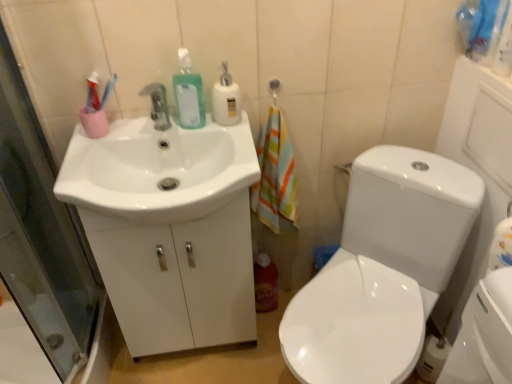
Question: Does point (328, 357) appear closer or farther from the camera than point (218, 117)?

Choices:
 (A) closer
 (B) farther

Answer: (A)

Question: Looking at their shapes, would you say white glossy toilet at right is wider or thinner than white glossy soap dispenser at upper center, the second cleaning product when ordered from left to right?

Choices:
 (A) thin
 (B) wide

Answer: (B)

Question: Which object is positioned closest to the white glossy toilet at right?

Choices:
 (A) green matte liquid soap at upper center, the third cleaning product in the bottom-to-top sequence
 (B) matte silver faucet at center
 (C) white glossy cabinet at left
 (D) white glossy soap dispenser at upper center, the second cleaning product when ordered from left to right
 (E) white glossy toilet at right

Answer: (E)

Question: Which is farther from the white glossy toilet at right?

Choices:
 (A) translucent plastic bottle at lower center, acting as the first cleaning product starting from the bottom
 (B) matte silver faucet at center
 (C) white glossy toilet at right
 (D) white glossy sink at left
 (E) green matte liquid soap at upper center, the third cleaning product in the bottom-to-top sequence

Answer: (B)